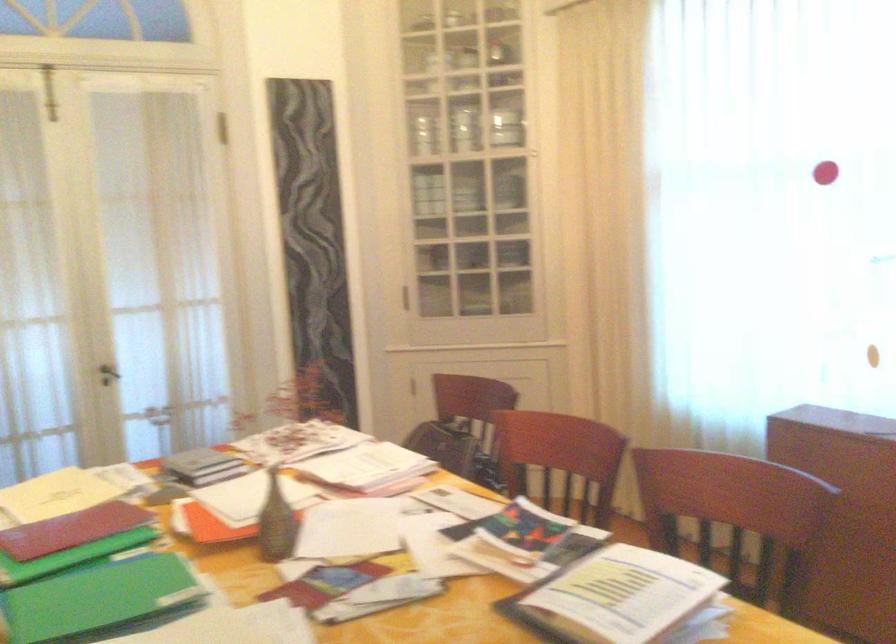
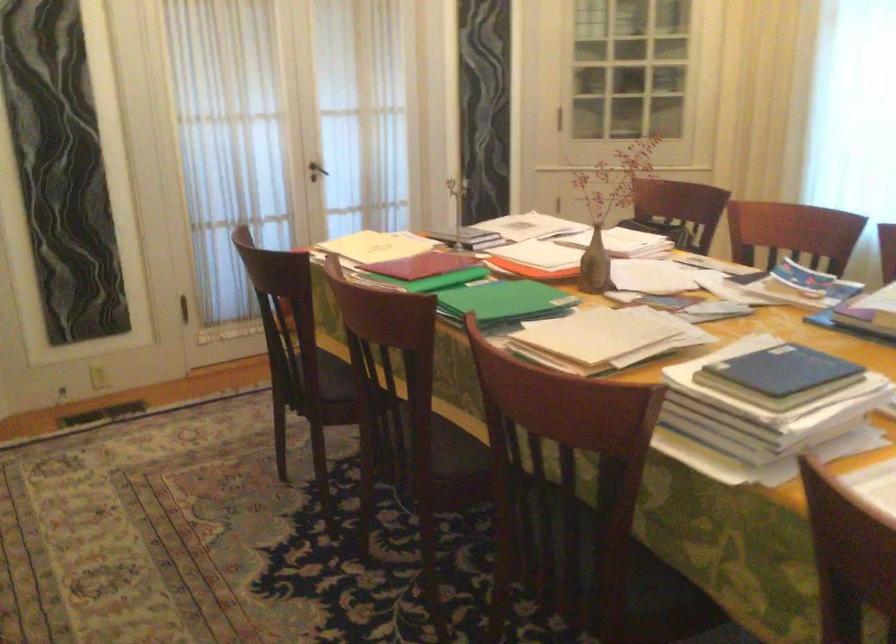
Find the pixel in the second image that matches [280,524] in the first image.

(595, 265)